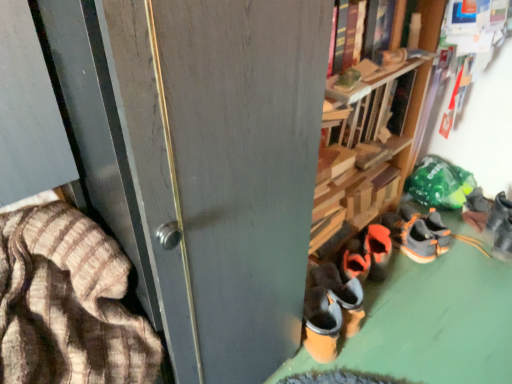
Question: Is matte gray screen door at center closer to the viewer compared to dark brown suede shoes at lower right, which is the first footwear in left-to-right order?

Choices:
 (A) yes
 (B) no

Answer: (A)

Question: Is matte gray screen door at center at the right side of dark brown suede shoes at lower right, which ranks as the 5th footwear in right-to-left order?

Choices:
 (A) yes
 (B) no

Answer: (B)

Question: From a real-world perspective, is matte gray screen door at center over dark brown suede shoes at lower right, which is the first footwear in left-to-right order?

Choices:
 (A) no
 (B) yes

Answer: (B)

Question: Does matte gray screen door at center have a lesser height compared to dark brown suede shoes at lower right, which ranks as the 5th footwear in right-to-left order?

Choices:
 (A) no
 (B) yes

Answer: (A)

Question: Is matte gray screen door at center wider than dark brown suede shoes at lower right, which is the first footwear in left-to-right order?

Choices:
 (A) no
 (B) yes

Answer: (B)

Question: From their relative heights in the image, would you say orange suede shoes at center, which ranks as the second footwear in left-to-right order, is taller or shorter than brown striped fabric at left?

Choices:
 (A) tall
 (B) short

Answer: (B)

Question: Considering the positions of orange suede shoes at center, the fourth footwear viewed from the right, and brown striped fabric at left in the image, is orange suede shoes at center, the fourth footwear viewed from the right, wider or thinner than brown striped fabric at left?

Choices:
 (A) thin
 (B) wide

Answer: (A)

Question: In terms of size, does orange suede shoes at center, which ranks as the second footwear in left-to-right order, appear bigger or smaller than brown striped fabric at left?

Choices:
 (A) small
 (B) big

Answer: (A)

Question: In the image, is orange suede shoes at center, which ranks as the second footwear in left-to-right order, positioned in front of or behind brown striped fabric at left?

Choices:
 (A) behind
 (B) front

Answer: (A)

Question: In terms of size, does hardcover book at upper center appear bigger or smaller than dark brown suede shoes at lower right, which is the first footwear in left-to-right order?

Choices:
 (A) big
 (B) small

Answer: (A)

Question: Based on their positions, is hardcover book at upper center located to the left or right of dark brown suede shoes at lower right, which is the first footwear in left-to-right order?

Choices:
 (A) left
 (B) right

Answer: (B)

Question: Is hardcover book at upper center taller or shorter than dark brown suede shoes at lower right, which is the first footwear in left-to-right order?

Choices:
 (A) tall
 (B) short

Answer: (A)

Question: In terms of width, does hardcover book at upper center look wider or thinner when compared to dark brown suede shoes at lower right, which is the first footwear in left-to-right order?

Choices:
 (A) wide
 (B) thin

Answer: (B)

Question: From a real-world perspective, is dark brown suede shoes at lower right, which ranks as the 5th footwear in right-to-left order, physically located above or below orange suede sneaker at lower right, which is the second footwear from right to left?

Choices:
 (A) above
 (B) below

Answer: (B)

Question: From the image's perspective, is dark brown suede shoes at lower right, which ranks as the 5th footwear in right-to-left order, positioned above or below orange suede sneaker at lower right, which is counted as the fourth footwear, starting from the left?

Choices:
 (A) below
 (B) above

Answer: (A)